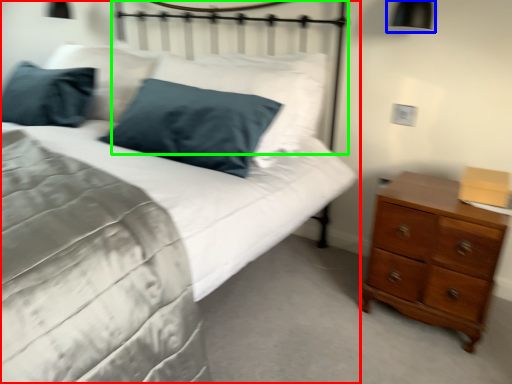
Question: Based on their relative distances, which object is farther from bed (highlighted by a red box)? Choose from bedside lamp (highlighted by a blue box) and headboard (highlighted by a green box).

Choices:
 (A) bedside lamp
 (B) headboard

Answer: (A)